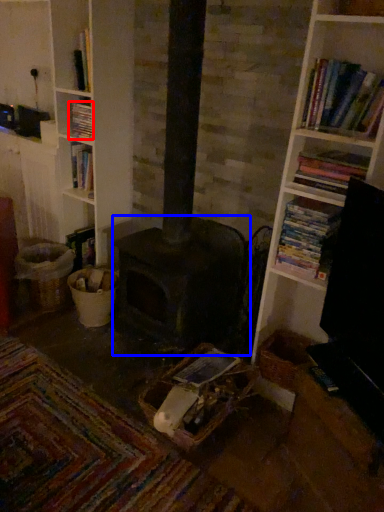
Question: Which object appears farthest to the camera in this image, book (highlighted by a red box) or heater (highlighted by a blue box)?

Choices:
 (A) book
 (B) heater

Answer: (A)